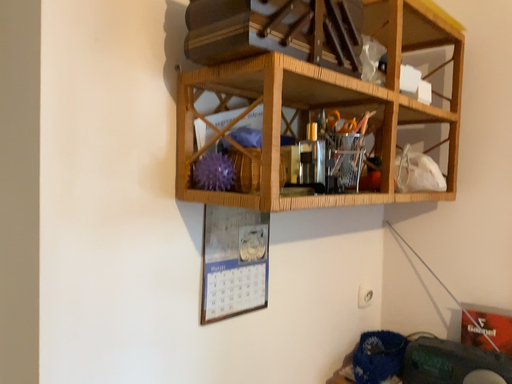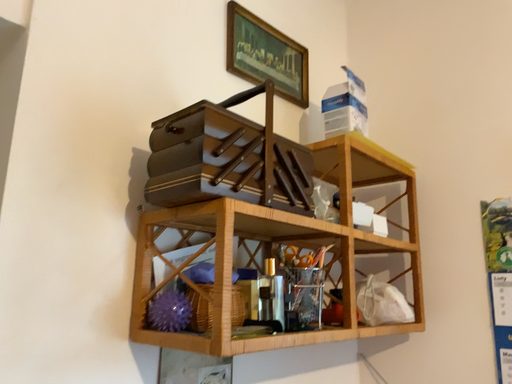
Question: How did the camera likely rotate when shooting the video?

Choices:
 (A) rotated upward
 (B) rotated downward

Answer: (A)